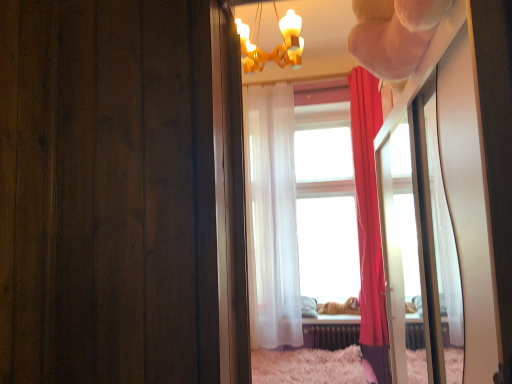
Measure the distance between golden fur dog at center and camera.

They are 13.76 feet apart.

Find the location of a particular element. The height and width of the screenshot is (384, 512). white glossy mirror at upper right is located at coordinates (420, 249).

You are a GUI agent. You are given a task and a screenshot of the screen. Output one action in this format:
    pyautogui.click(x=<x>, y=<y>)
    Task: Click on the silky red curtain at right, which is the second curtain from left to right
    The height and width of the screenshot is (384, 512).
    Given the screenshot: What is the action you would take?
    pyautogui.click(x=368, y=205)

You are a GUI agent. You are given a task and a screenshot of the screen. Output one action in this format:
    pyautogui.click(x=<x>, y=<y>)
    Task: Click on the radiator behind the silky red curtain at right, which is the second curtain from left to right
    This screenshot has height=384, width=512.
    Given the screenshot: What is the action you would take?
    331,336

Is point (371, 118) closer or farther from the camera than point (308, 324)?

Point (371, 118) appears to be closer to the viewer than point (308, 324).

Is silky red curtain at right, which is the first curtain from right to left, not near metallic radiator at lower center?

No, silky red curtain at right, which is the first curtain from right to left, is not far from metallic radiator at lower center.

In the scene shown: In terms of width, does silky red curtain at right, which is the first curtain from right to left, look wider or thinner when compared to metallic radiator at lower center?

Clearly, silky red curtain at right, which is the first curtain from right to left, has more width compared to metallic radiator at lower center.

How different are the orientations of silky red curtain at right, which is the second curtain from left to right, and gold textured chandelier at upper center in degrees?

The angle between the facing direction of silky red curtain at right, which is the second curtain from left to right, and the facing direction of gold textured chandelier at upper center is 1.24 degrees.

Measure the distance between silky red curtain at right, which is the first curtain from right to left, and gold textured chandelier at upper center.

silky red curtain at right, which is the first curtain from right to left, is 1.46 meters away from gold textured chandelier at upper center.

Which is in front, silky red curtain at right, which is the second curtain from left to right, or gold textured chandelier at upper center?

gold textured chandelier at upper center is closer to the camera.

Considering the relative sizes of silky red curtain at right, which is the first curtain from right to left, and gold textured chandelier at upper center in the image provided, is silky red curtain at right, which is the first curtain from right to left, bigger than gold textured chandelier at upper center?

→ Correct, silky red curtain at right, which is the first curtain from right to left, is larger in size than gold textured chandelier at upper center.

Considering the sizes of objects gold textured chandelier at upper center and metallic radiator at lower center in the image provided, who is shorter, gold textured chandelier at upper center or metallic radiator at lower center?

With less height is metallic radiator at lower center.

From the image's perspective, is gold textured chandelier at upper center over metallic radiator at lower center?

Correct, gold textured chandelier at upper center appears higher than metallic radiator at lower center in the image.

Looking at the image, does gold textured chandelier at upper center seem bigger or smaller compared to metallic radiator at lower center?

Considering their sizes, gold textured chandelier at upper center takes up more space than metallic radiator at lower center.

From a real-world perspective, is gold textured chandelier at upper center physically below metallic radiator at lower center?

No.

Considering the sizes of silky red curtain at right, which is the first curtain from right to left, and white glossy mirror at upper right in the image, is silky red curtain at right, which is the first curtain from right to left, taller or shorter than white glossy mirror at upper right?

silky red curtain at right, which is the first curtain from right to left, is taller than white glossy mirror at upper right.

Based on the photo, who is bigger, silky red curtain at right, which is the second curtain from left to right, or white glossy mirror at upper right?

Bigger between the two is white glossy mirror at upper right.

How many degrees apart are the facing directions of silky red curtain at right, which is the second curtain from left to right, and white glossy mirror at upper right?

There is a 88.5-degree angle between the facing directions of silky red curtain at right, which is the second curtain from left to right, and white glossy mirror at upper right.

From the image's perspective, is silky red curtain at right, which is the second curtain from left to right, on top of white glossy mirror at upper right?

Yes, from the image's perspective, silky red curtain at right, which is the second curtain from left to right, is above white glossy mirror at upper right.

From the image's perspective, relative to silky red curtain at right, which is the second curtain from left to right, is gold textured chandelier at upper center above or below?

Clearly, from the image's perspective, gold textured chandelier at upper center is above silky red curtain at right, which is the second curtain from left to right.

Is gold textured chandelier at upper center behind silky red curtain at right, which is the first curtain from right to left?

No.

Is gold textured chandelier at upper center shorter than silky red curtain at right, which is the second curtain from left to right?

Yes.

Which is less distant, (258, 70) or (371, 169)?

Point (258, 70) is closer to the camera than point (371, 169).

Is white glossy mirror at upper right aimed at metallic radiator at lower center?

No, white glossy mirror at upper right is not turned towards metallic radiator at lower center.

Considering the relative sizes of white glossy mirror at upper right and metallic radiator at lower center in the image provided, is white glossy mirror at upper right wider than metallic radiator at lower center?

Yes.

Does point (425, 338) come closer to viewer compared to point (330, 329)?

Yes, it is.

Considering the sizes of white glossy mirror at upper right and metallic radiator at lower center in the image, is white glossy mirror at upper right taller or shorter than metallic radiator at lower center?

white glossy mirror at upper right is taller than metallic radiator at lower center.

From a real-world perspective, is gold textured chandelier at upper center on white glossy mirror at upper right?

Yes.

Can you confirm if gold textured chandelier at upper center is thinner than white glossy mirror at upper right?

Indeed, gold textured chandelier at upper center has a lesser width compared to white glossy mirror at upper right.

Between gold textured chandelier at upper center and white glossy mirror at upper right, which one is positioned in front?

white glossy mirror at upper right is closer to the camera.

Looking at this image, is gold textured chandelier at upper center bigger or smaller than white glossy mirror at upper right?

gold textured chandelier at upper center is smaller than white glossy mirror at upper right.

The height and width of the screenshot is (384, 512). I want to click on radiator to the left of silky red curtain at right, which is the first curtain from right to left, so click(x=331, y=336).

I want to click on the 1st curtain behind the gold textured chandelier at upper center, so click(368, 205).

From the image, which object appears to be farther from golden fur dog at center, metallic radiator at lower center or translucent white curtain at center, the 2th curtain when ordered from right to left?

translucent white curtain at center, the 2th curtain when ordered from right to left, is positioned further to the anchor golden fur dog at center.

When comparing their distances from metallic radiator at lower center, does white glossy mirror at upper right or silky red curtain at right, which is the second curtain from left to right, seem closer?

Among the two, silky red curtain at right, which is the second curtain from left to right, is located nearer to metallic radiator at lower center.

Looking at the image, which one is located further to translucent white curtain at center, acting as the first curtain starting from the left, metallic radiator at lower center or white glossy mirror at upper right?

The object further to translucent white curtain at center, acting as the first curtain starting from the left, is white glossy mirror at upper right.

Which object lies further to the anchor point gold textured chandelier at upper center, translucent white curtain at center, the 2th curtain when ordered from right to left, or golden fur dog at center?

golden fur dog at center.

From the image, which object appears to be farther from golden fur dog at center, silky red curtain at right, which is the first curtain from right to left, or gold textured chandelier at upper center?

gold textured chandelier at upper center lies further to golden fur dog at center than the other object.

Which object lies further to the anchor point translucent white curtain at center, acting as the first curtain starting from the left, silky red curtain at right, which is the first curtain from right to left, or gold textured chandelier at upper center?

gold textured chandelier at upper center is positioned further to the anchor translucent white curtain at center, acting as the first curtain starting from the left.

Considering their positions, is golden fur dog at center positioned closer to metallic radiator at lower center than white glossy mirror at upper right?

Among the two, golden fur dog at center is located nearer to metallic radiator at lower center.

Estimate the real-world distances between objects in this image. Which object is closer to silky red curtain at right, which is the second curtain from left to right, metallic radiator at lower center or translucent white curtain at center, acting as the first curtain starting from the left?

The object closer to silky red curtain at right, which is the second curtain from left to right, is translucent white curtain at center, acting as the first curtain starting from the left.

This screenshot has width=512, height=384. Identify the location of curtain between silky red curtain at right, which is the second curtain from left to right, and metallic radiator at lower center, in the vertical direction. (272, 217).

Locate an element on the screen. animal between silky red curtain at right, which is the first curtain from right to left, and metallic radiator at lower center from top to bottom is located at coordinates (340, 307).

The height and width of the screenshot is (384, 512). What are the coordinates of `lamp positioned between white glossy mirror at upper right and translucent white curtain at center, the 2th curtain when ordered from right to left, from near to far` in the screenshot? It's located at (275, 47).

The width and height of the screenshot is (512, 384). Find the location of `animal between translucent white curtain at center, acting as the first curtain starting from the left, and metallic radiator at lower center, in the vertical direction`. animal between translucent white curtain at center, acting as the first curtain starting from the left, and metallic radiator at lower center, in the vertical direction is located at coordinates (340, 307).